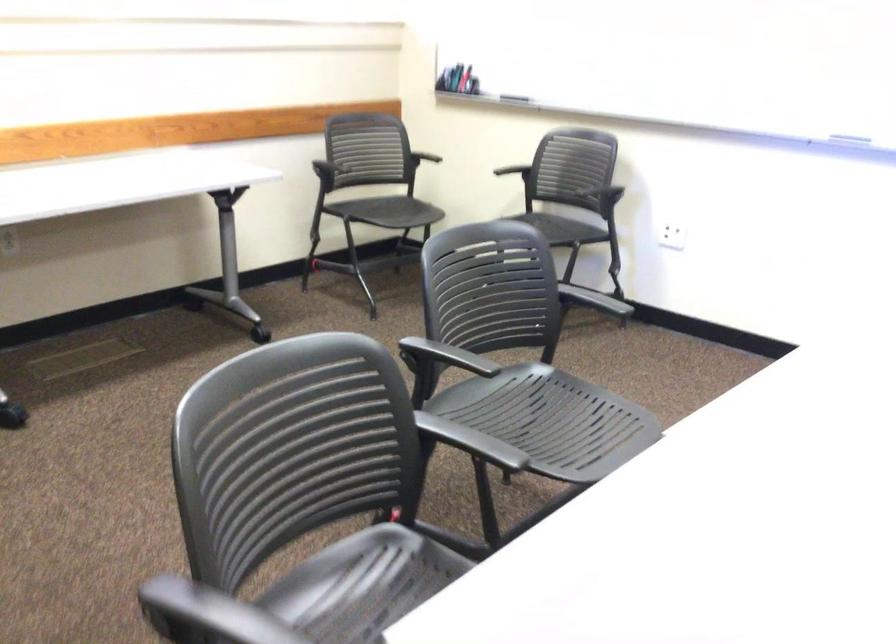
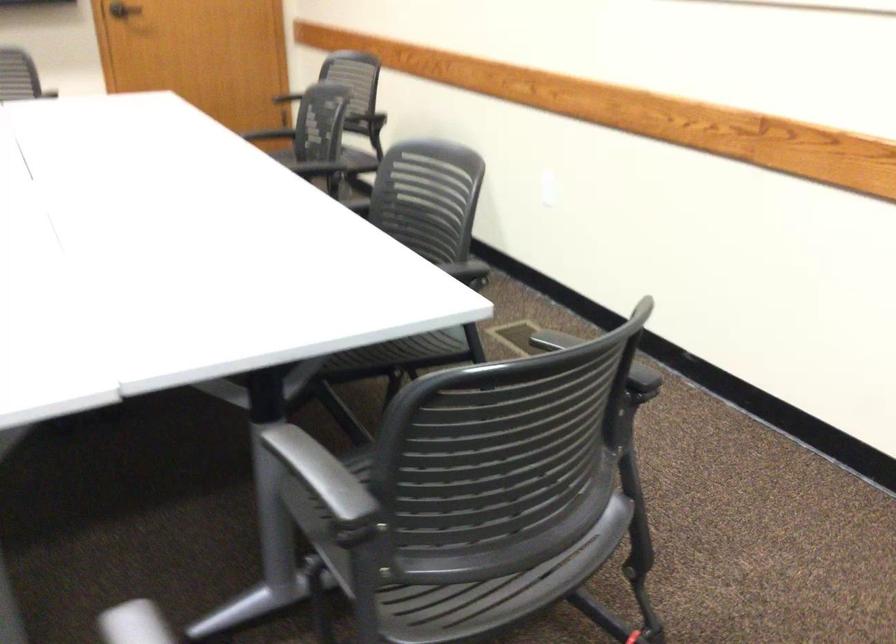
The point at (x=248, y=422) is marked in the first image. Where is the corresponding point in the second image?

(598, 359)